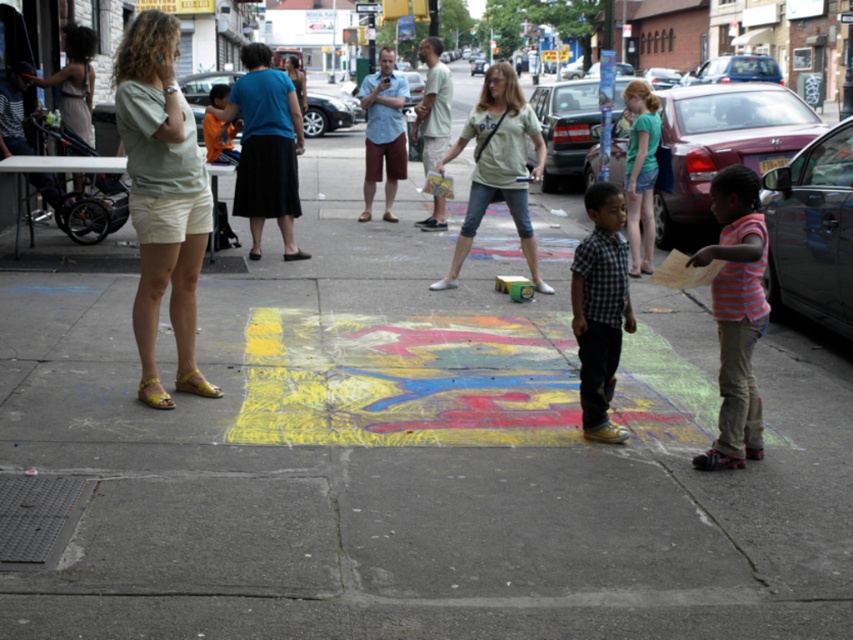
You are a photographer trying to capture both the striped cotton shirt at lower right and the matte blue shirt at center in a single frame. Given their sizes, which shirt will appear larger in the photo?

The matte blue shirt at center will appear larger in the photo because it has a bigger size than the striped cotton shirt at lower right.